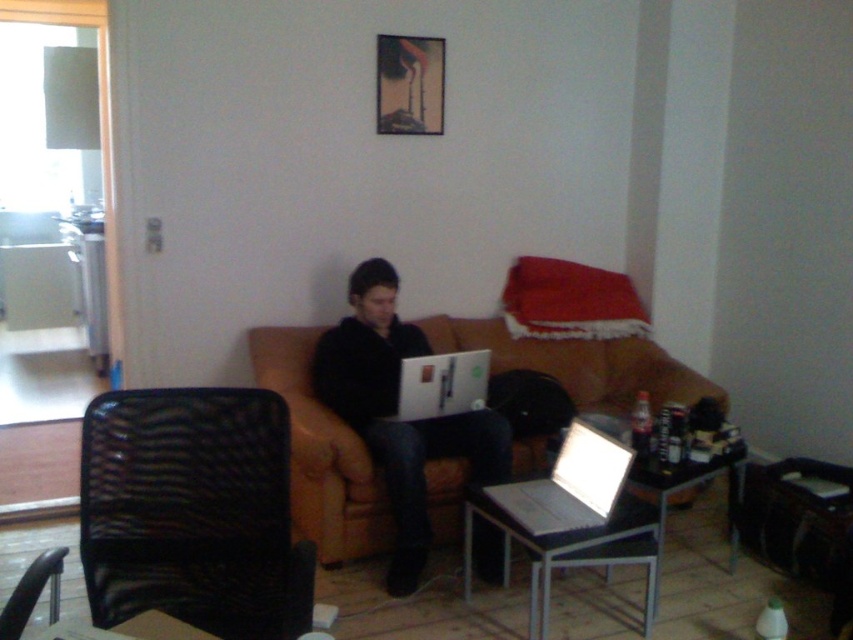
Question: Which point appears farthest from the camera in this image?

Choices:
 (A) (334, 355)
 (B) (114, 444)

Answer: (A)

Question: Which is farther from the black mesh chair at left?

Choices:
 (A) silver metallic laptop at lower center
 (B) brown leather couch at center
 (C) black matte laptop at center
 (D) matte black laptop at center

Answer: (D)

Question: Which of the following is the farthest from the observer?

Choices:
 (A) (325, 344)
 (B) (239, 556)
 (C) (318, 497)

Answer: (A)

Question: Is the position of silver metallic laptop at lower center more distant than that of matte black laptop at center?

Choices:
 (A) no
 (B) yes

Answer: (A)

Question: Does brown leather couch at center appear on the left side of black matte laptop at center?

Choices:
 (A) no
 (B) yes

Answer: (B)

Question: From the image, what is the correct spatial relationship of black matte laptop at center in relation to silver metallic laptop at lower center?

Choices:
 (A) above
 (B) below

Answer: (A)